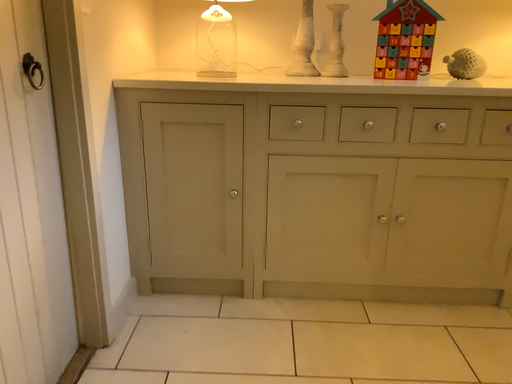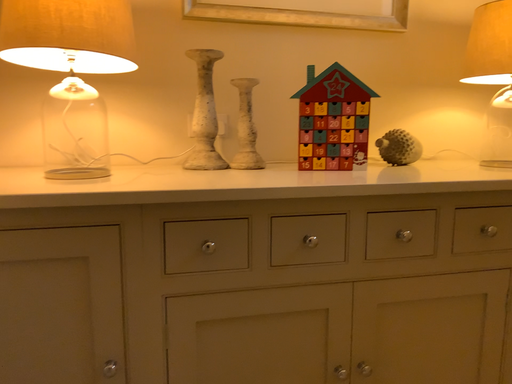
Question: Which way did the camera rotate in the video?

Choices:
 (A) rotated right
 (B) rotated left

Answer: (A)